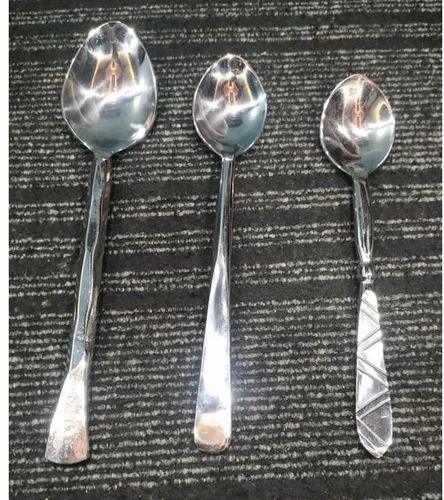
Where is `spoon`? The width and height of the screenshot is (444, 500). spoon is located at coordinates (240, 137).